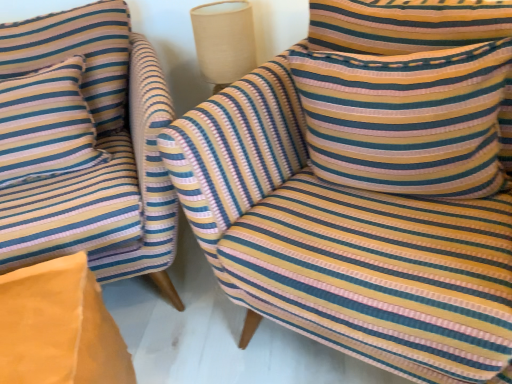
Locate an element on the screen. This screenshot has height=384, width=512. empty space that is ontop of orange fabric cushion at lower left (from a real-world perspective) is located at coordinates (25, 314).